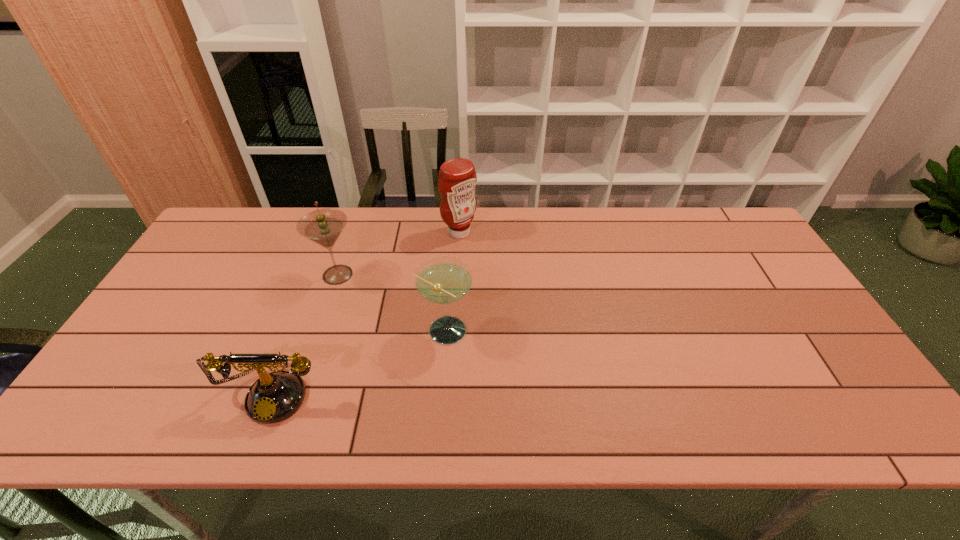
Find the location of `condiment`. condiment is located at coordinates (457, 179).

Where is `the second farthest object`? Image resolution: width=960 pixels, height=540 pixels. the second farthest object is located at coordinates (323, 226).

This screenshot has width=960, height=540. Identify the location of the farther martini. (323, 226).

Where is `the second nearest object`? the second nearest object is located at coordinates (444, 280).

At what (x,y) coordinates should I click in order to perform the action: click on the right martini. Please return your answer as a coordinate pair (x, y). The width and height of the screenshot is (960, 540). Looking at the image, I should click on (444, 280).

Where is `the shortest object`? the shortest object is located at coordinates (274, 397).

This screenshot has height=540, width=960. Identify the location of telephone. (274, 397).

Where is `vacant space located 0.250m on the left of the condiment`? The image size is (960, 540). vacant space located 0.250m on the left of the condiment is located at coordinates (366, 232).

At what (x,y) coordinates should I click in order to perform the action: click on free location located 0.270m on the right of the left martini. Please return your answer as a coordinate pair (x, y). The image size is (960, 540). Looking at the image, I should click on (451, 275).

Where is `vacant space situated 0.080m on the front of the right martini`? The width and height of the screenshot is (960, 540). vacant space situated 0.080m on the front of the right martini is located at coordinates (440, 380).